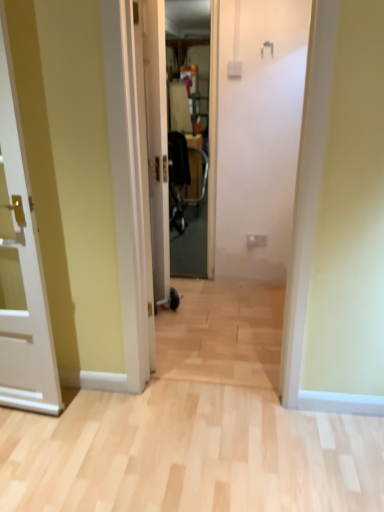
The height and width of the screenshot is (512, 384). Identify the location of free spot to the right of white glossy door at left, which is the 2th door from back to front. (81, 444).